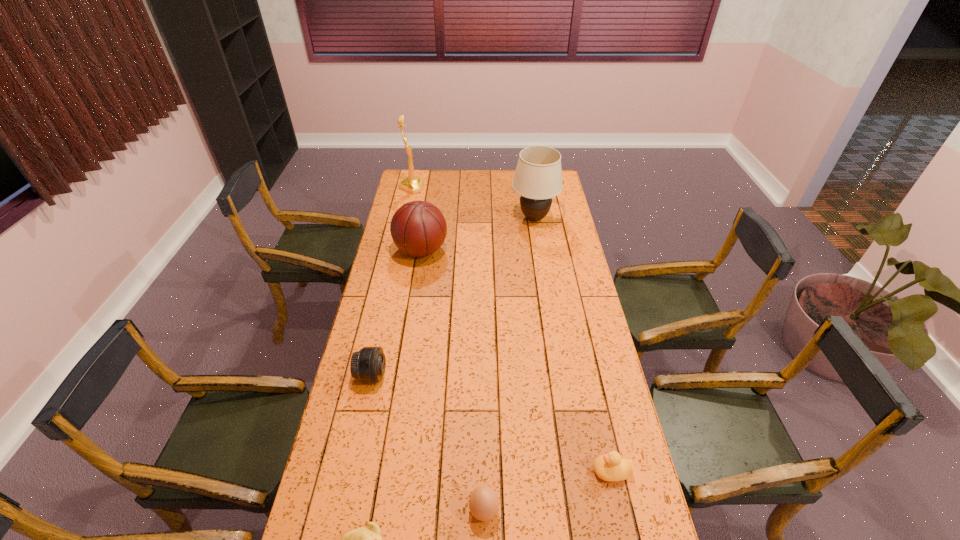
Locate an element on the screen. vacant region located 0.260m on the front-facing side of the telephoto lens is located at coordinates click(x=463, y=375).

The image size is (960, 540). I want to click on free space located on the right of the third object from right to left, so click(x=635, y=510).

What are the coordinates of `vacant space situated 0.340m on the face of the third nearest object` in the screenshot? It's located at (473, 471).

Where is `vacant space situated on the face of the third nearest object`? This screenshot has height=540, width=960. vacant space situated on the face of the third nearest object is located at coordinates [x=540, y=471].

At what (x,y) coordinates should I click in order to perform the action: click on vacant space located on the face of the third nearest object. Please return your answer as a coordinate pair (x, y). Image resolution: width=960 pixels, height=540 pixels. Looking at the image, I should click on (501, 471).

Locate an element on the screen. The width and height of the screenshot is (960, 540). object at the far edge is located at coordinates (412, 184).

Where is `award situated at the left edge`? This screenshot has width=960, height=540. award situated at the left edge is located at coordinates (412, 184).

The image size is (960, 540). I want to click on basketball that is at the left edge, so click(418, 228).

Where is `telephoto lens situated at the left edge`? This screenshot has height=540, width=960. telephoto lens situated at the left edge is located at coordinates (368, 365).

In order to click on lampshade present at the right edge in this screenshot , I will do (x=538, y=177).